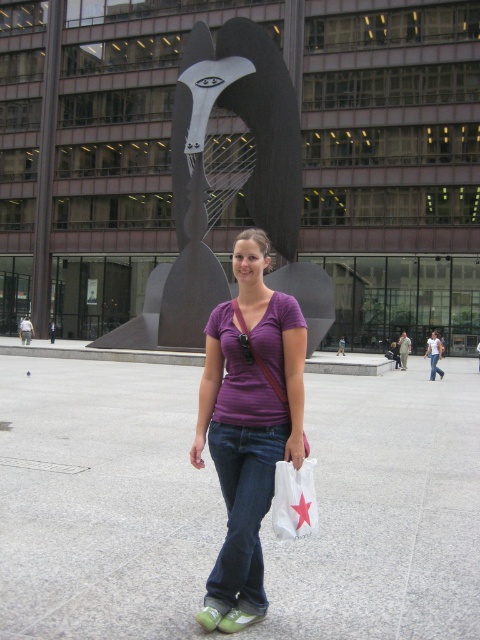
Question: Considering the real-world distances, which object is closest to the denim at center?

Choices:
 (A) white plastic bag at center
 (B) denim jeans at center
 (C) purple cotton shirt at center

Answer: (C)

Question: Considering the real-world distances, which object is farthest from the polished bronze sculpture at center?

Choices:
 (A) purple fabric shirt at center
 (B) denim at center
 (C) purple cotton shirt at center
 (D) white plastic bag at center

Answer: (D)

Question: Is white plastic bag at center thinner than denim jeans at center?

Choices:
 (A) yes
 (B) no

Answer: (A)

Question: Which of the following is the farthest from the observer?

Choices:
 (A) (276, 337)
 (B) (233, 506)

Answer: (A)

Question: Considering the relative positions of denim at center and purple fabric shirt at center in the image provided, where is denim at center located with respect to purple fabric shirt at center?

Choices:
 (A) left
 (B) right

Answer: (A)

Question: Does polished bronze sculpture at center have a lesser width compared to denim at center?

Choices:
 (A) no
 (B) yes

Answer: (A)